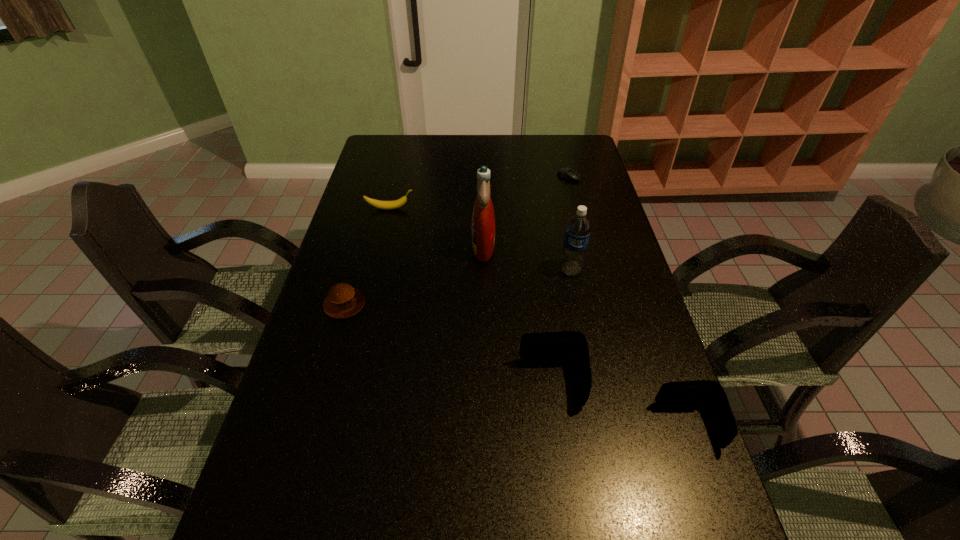
Identify the location of vacant space located on the front of the second tallest object. The width and height of the screenshot is (960, 540). (584, 335).

Find the location of `free space located 0.160m on the front surface of the detergent`. free space located 0.160m on the front surface of the detergent is located at coordinates (421, 247).

Where is `free space located 0.110m on the front surface of the detergent`? Image resolution: width=960 pixels, height=540 pixels. free space located 0.110m on the front surface of the detergent is located at coordinates (437, 247).

Image resolution: width=960 pixels, height=540 pixels. I want to click on free space located 0.400m on the front surface of the detergent, so pyautogui.click(x=345, y=247).

This screenshot has height=540, width=960. Find the location of `free spot located 0.390m at the stem of the banana`. free spot located 0.390m at the stem of the banana is located at coordinates (527, 208).

The image size is (960, 540). What are the coordinates of `muffin that is at the left edge` in the screenshot? It's located at (343, 301).

Locate an element on the screen. banana at the left edge is located at coordinates (387, 205).

Find the location of a particular element. The image size is (960, 540). wallet that is at the right edge is located at coordinates (711, 394).

Where is `computer mouse that is at the right edge`? computer mouse that is at the right edge is located at coordinates (568, 173).

Find the location of a particular element. water bottle situated at the right edge is located at coordinates (578, 228).